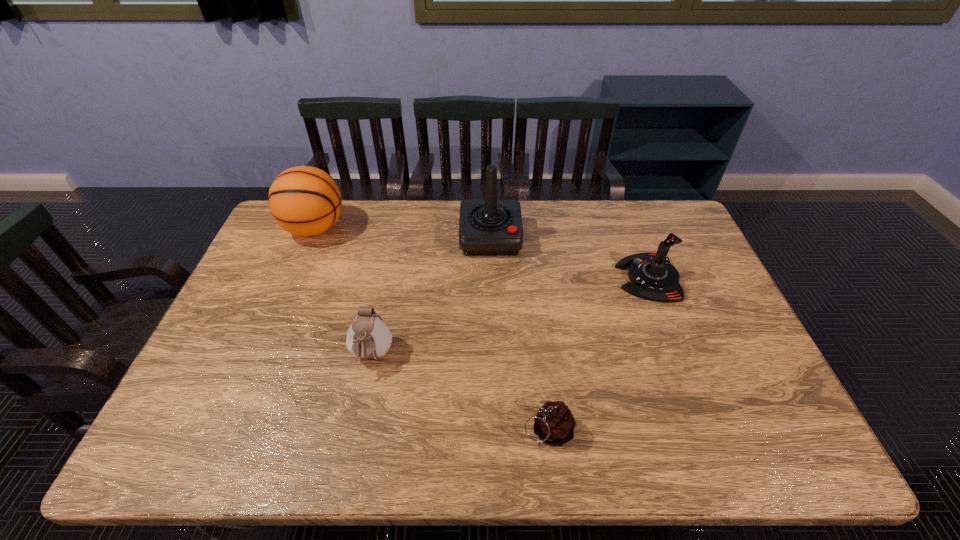
Where is `the left joystick`? Image resolution: width=960 pixels, height=540 pixels. the left joystick is located at coordinates (490, 227).

Where is `the taller joystick`? the taller joystick is located at coordinates (490, 227).

You are a GUI agent. You are given a task and a screenshot of the screen. Output one action in this format:
    pyautogui.click(x=<x>, y=<y>)
    Task: Click on the leftmost object
    The width and height of the screenshot is (960, 540).
    Given the screenshot: What is the action you would take?
    pyautogui.click(x=304, y=200)

At what (x,y) coordinates should I click in order to perform the action: click on the second tallest object. Please return your answer as a coordinate pair (x, y). Looking at the image, I should click on (304, 200).

You are a GUI agent. You are given a task and a screenshot of the screen. Output one action in this format:
    pyautogui.click(x=<x>, y=<y>)
    Task: Click on the shorter joystick
    Image resolution: width=960 pixels, height=540 pixels.
    Given the screenshot: What is the action you would take?
    pyautogui.click(x=653, y=277)

Identify the location of the right joystick. (653, 277).

Identify the location of pouch. The height and width of the screenshot is (540, 960). (368, 337).

The width and height of the screenshot is (960, 540). In order to click on the second nearest object in this screenshot , I will do `click(368, 337)`.

I want to click on pinecone, so click(x=554, y=424).

The height and width of the screenshot is (540, 960). In order to click on the shortest object in this screenshot , I will do `click(554, 424)`.